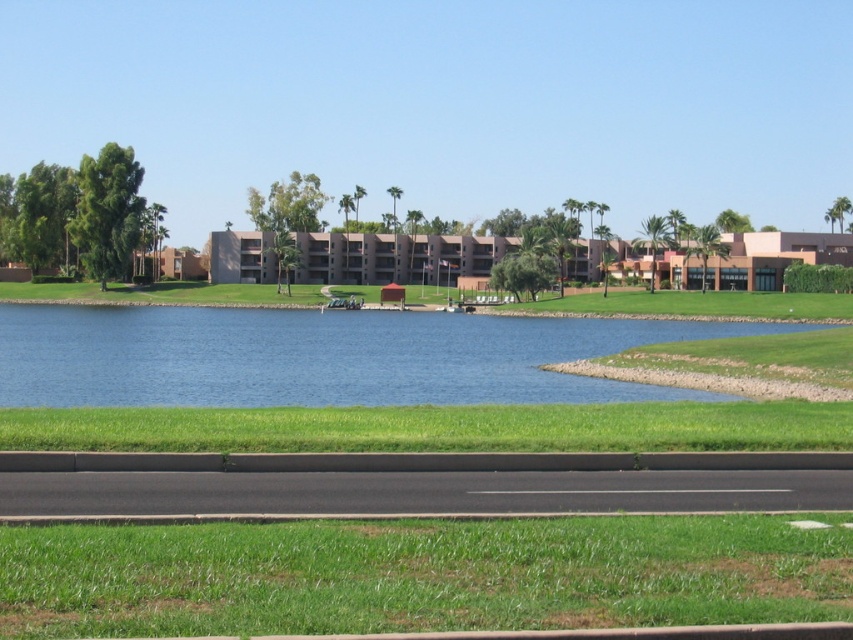
You are a drone operator trying to capture aerial footage of the suburban landscape. Your drone is currently hovering above the green grass at lower center and the blue water at center. Which object is closer to your drone? Please explain your reasoning based on the scene description.

The green grass at lower center is closer to the viewer than the blue water at center. Since the drone is hovering above these objects, the green grass at lower center would be closer to the drone as well.

You are a landscape architect designing a new park. You have to decide where to place a new playground. The playground requires a large open space. Based on the image, which area would be more suitable for the playground, the green grass at lower center or the blue water at center?

The blue water at center occupies more space than the green grass at lower center, so the blue water at center would be more suitable for the playground as it provides a larger open area.